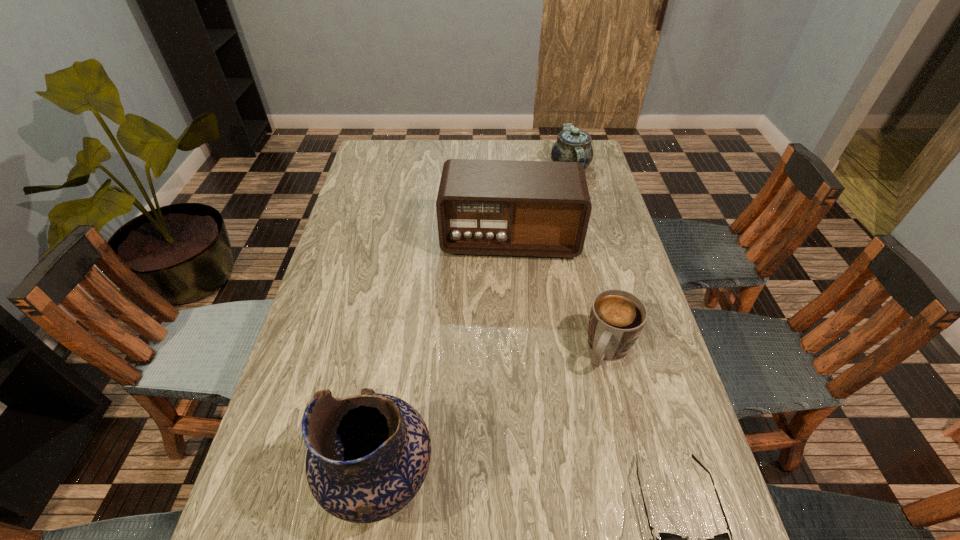
The width and height of the screenshot is (960, 540). I want to click on vacant spot on the desktop that is between the tallest object and the shortest object and is positioned on the side of the third nearest object with the handle, so click(537, 490).

In order to click on vacant space on the desktop that is between the pottery and the sunglasses and is positioned on the front-facing side of the fourth shortest object in this screenshot , I will do `click(510, 489)`.

Identify the location of vacant spot on the desktop that is between the tallest object and the shortest object and is positioned from the spout of the chinaware. The height and width of the screenshot is (540, 960). (510, 489).